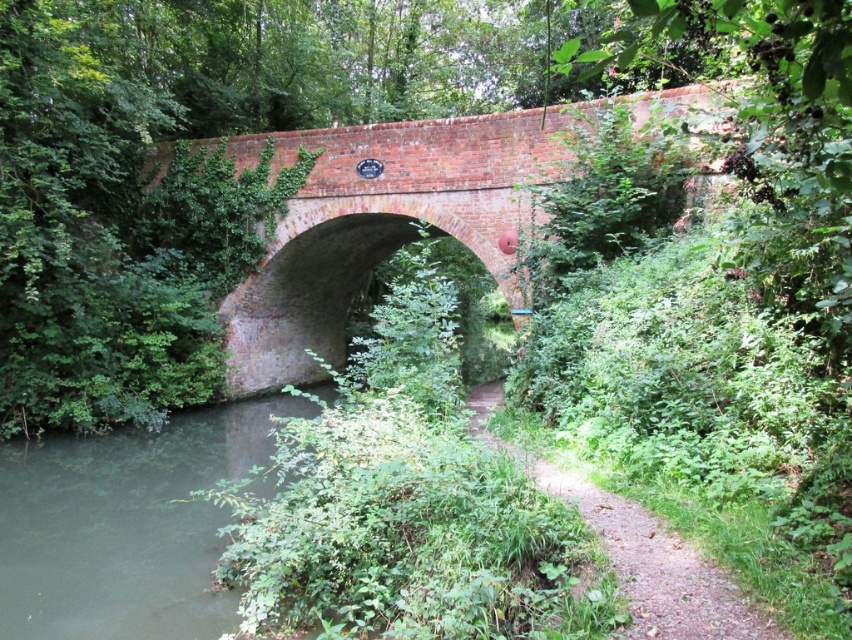
Is brick at center further to camera compared to dirt path at center?

Yes, it is behind dirt path at center.

Between brick at center and dirt path at center, which one is positioned lower?

dirt path at center is below.

Between point (239, 156) and point (704, 592), which one is positioned behind?

The point (239, 156) is more distant.

Image resolution: width=852 pixels, height=640 pixels. What are the coordinates of `brick at center` in the screenshot? It's located at (401, 218).

The height and width of the screenshot is (640, 852). What do you see at coordinates (125, 525) in the screenshot? I see `green murky water at lower left` at bounding box center [125, 525].

Can you confirm if green murky water at lower left is positioned to the right of dirt path at center?

No, green murky water at lower left is not to the right of dirt path at center.

Does point (91, 531) lie in front of point (651, 522)?

No, (91, 531) is further to viewer.

Find the location of a particular element. green murky water at lower left is located at coordinates (125, 525).

Does brick at center have a greater height compared to green murky water at lower left?

Yes.

Is brick at center positioned at the back of green murky water at lower left?

Yes, it is.

Is point (537, 128) behind point (222, 428)?

No, (537, 128) is closer to viewer.

Find the location of a particular element. The width and height of the screenshot is (852, 640). brick at center is located at coordinates (401, 218).